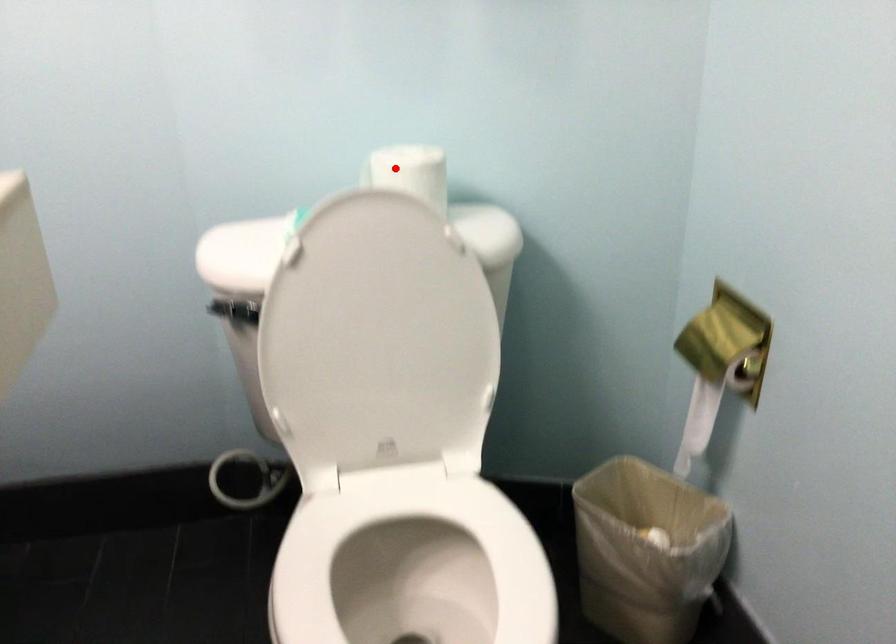
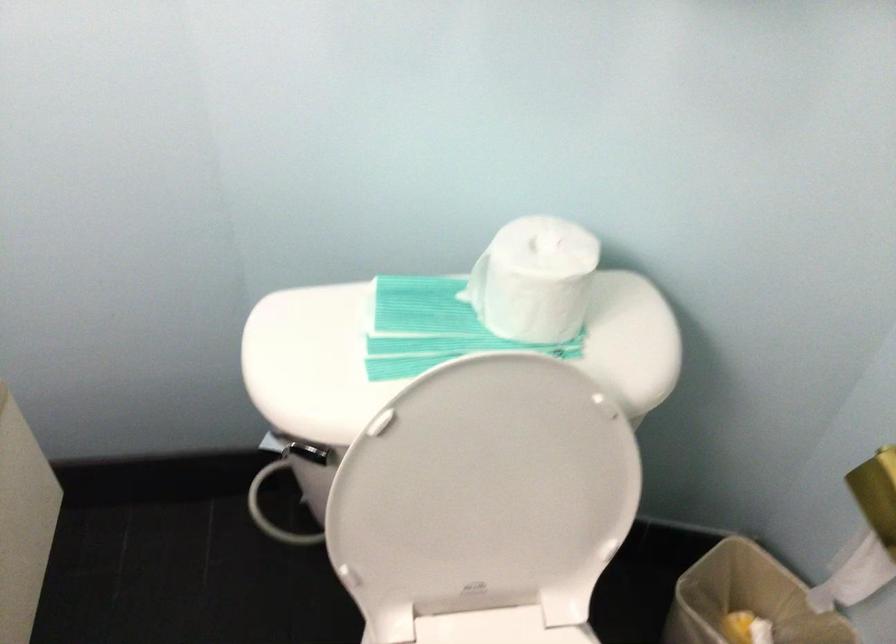
Question: A red point is marked in image1. In image2, is the corresponding 3D point closer to the camera or farther? Reply with the corresponding letter.

Choices:
 (A) The corresponding 3D point is closer.
 (B) The corresponding 3D point is farther.

Answer: (A)